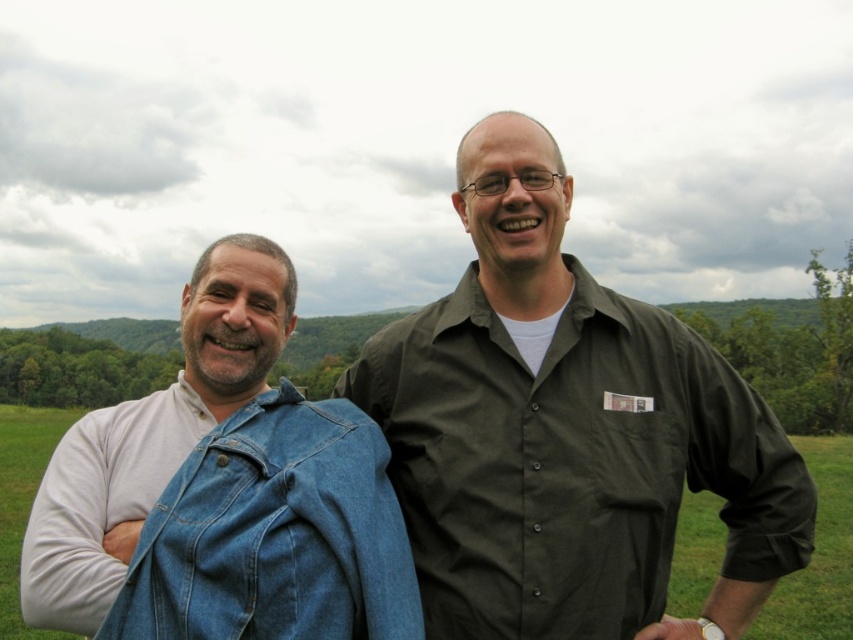
Can you confirm if matte green shirt at center is positioned below faded denim jacket at lower right?

Yes, matte green shirt at center is below faded denim jacket at lower right.

Does matte green shirt at center lie in front of faded denim jacket at lower right?

No, matte green shirt at center is further to the viewer.

The height and width of the screenshot is (640, 853). I want to click on matte green shirt at center, so click(x=566, y=432).